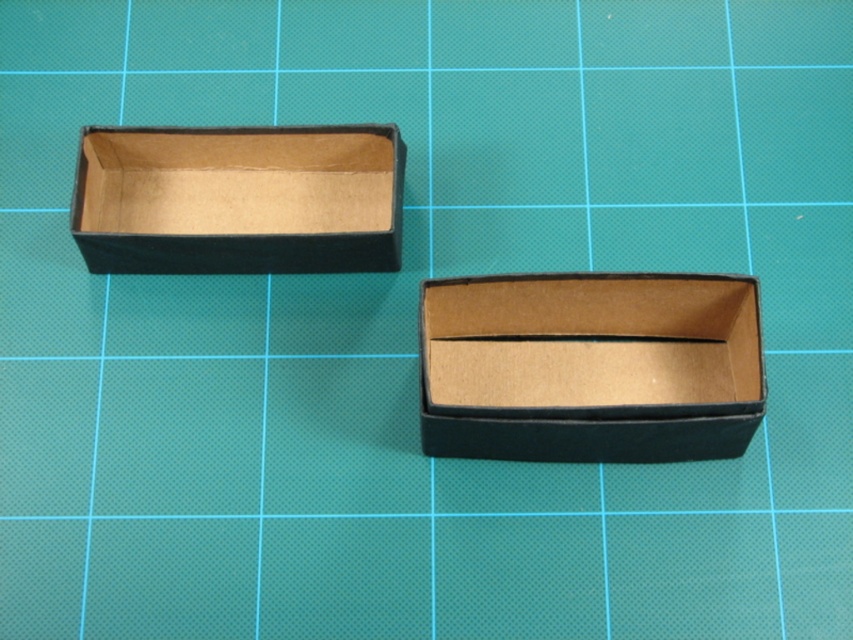
Does matte cardboard box at center come behind matte black box at upper left?

No, it is in front of matte black box at upper left.

Between matte cardboard box at center and matte black box at upper left, which one has more height?

matte cardboard box at center

Locate an element on the screen. This screenshot has width=853, height=640. matte cardboard box at center is located at coordinates (590, 368).

Find the location of a particular element. matte cardboard box at center is located at coordinates (590, 368).